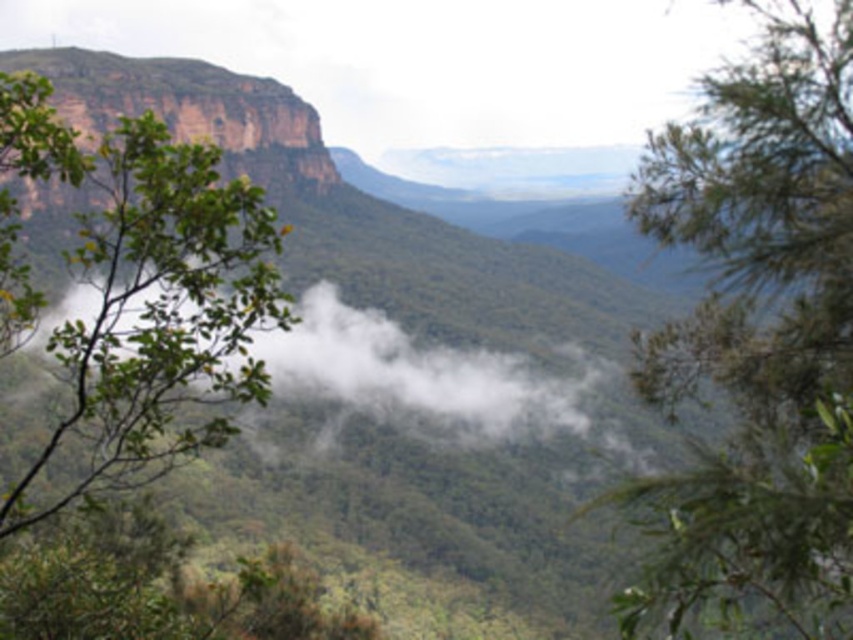
Between green leafy tree at upper left and white fluffy cloud at center, which one is positioned higher?

Positioned higher is white fluffy cloud at center.

Does green leafy tree at upper left have a larger size compared to white fluffy cloud at center?

Yes, green leafy tree at upper left is bigger than white fluffy cloud at center.

What are the coordinates of `green leafy tree at upper left` in the screenshot? It's located at (753, 346).

Can you confirm if green leafy tree at left is thinner than white fluffy cloud at center?

Correct, green leafy tree at left's width is less than white fluffy cloud at center's.

Does green leafy tree at left appear under white fluffy cloud at center?

No, green leafy tree at left is not below white fluffy cloud at center.

Which is behind, point (193, 227) or point (463, 401)?

The point (463, 401) is more distant.

Locate an element on the screen. green leafy tree at left is located at coordinates (148, 292).

Measure the distance between green leafy tree at upper left and green leafy tree at left.

They are 42.70 meters apart.

Which of these two, green leafy tree at upper left or green leafy tree at left, stands shorter?

With less height is green leafy tree at upper left.

Locate an element on the screen. This screenshot has width=853, height=640. green leafy tree at upper left is located at coordinates (753, 346).

The image size is (853, 640). I want to click on green leafy tree at upper left, so click(x=753, y=346).